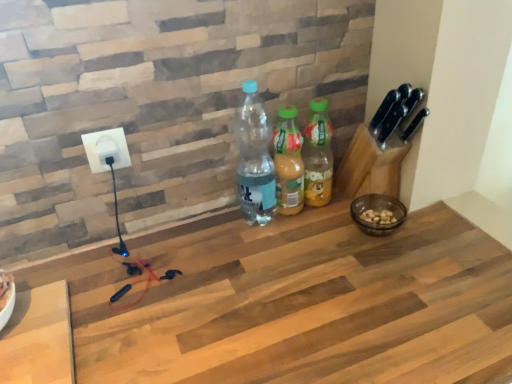
Question: From the image's perspective, does white plastic socket at upper left appear higher than translucent plastic bottle at center, which is counted as the second bottle, starting from the right?

Choices:
 (A) yes
 (B) no

Answer: (A)

Question: From the image's perspective, would you say white plastic socket at upper left is shown under translucent plastic bottle at center, which is counted as the second bottle, starting from the right?

Choices:
 (A) yes
 (B) no

Answer: (B)

Question: Does white plastic socket at upper left touch translucent plastic bottle at center, which is counted as the second bottle, starting from the right?

Choices:
 (A) yes
 (B) no

Answer: (B)

Question: Does white plastic socket at upper left appear on the right side of translucent plastic bottle at center, which is counted as the second bottle, starting from the right?

Choices:
 (A) yes
 (B) no

Answer: (B)

Question: Is white plastic socket at upper left aimed at translucent plastic bottle at center, which is counted as the second bottle, starting from the right?

Choices:
 (A) no
 (B) yes

Answer: (A)

Question: Based on their sizes in the image, would you say translucent plastic bottle at center, the 2th bottle from the left, is bigger or smaller than wooden at center?

Choices:
 (A) small
 (B) big

Answer: (A)

Question: Considering their positions, is translucent plastic bottle at center, the 2th bottle from the left, located in front of or behind wooden at center?

Choices:
 (A) front
 (B) behind

Answer: (B)

Question: Choose the correct answer: Is translucent plastic bottle at center, which is counted as the second bottle, starting from the right, inside wooden at center or outside it?

Choices:
 (A) inside
 (B) outside

Answer: (B)

Question: Is point (281, 127) closer or farther from the camera than point (333, 314)?

Choices:
 (A) farther
 (B) closer

Answer: (A)

Question: Which is correct: wooden at center is inside translucent plastic bottle at center, which is counted as the second bottle, starting from the right, or outside of it?

Choices:
 (A) outside
 (B) inside

Answer: (A)

Question: Is point (91, 269) positioned closer to the camera than point (271, 139)?

Choices:
 (A) closer
 (B) farther

Answer: (A)

Question: Considering the positions of wooden at center and translucent plastic bottle at center, which is counted as the second bottle, starting from the right, in the image, is wooden at center wider or thinner than translucent plastic bottle at center, which is counted as the second bottle, starting from the right,?

Choices:
 (A) thin
 (B) wide

Answer: (B)

Question: In the image, is wooden at center positioned in front of or behind translucent plastic bottle at center, which is counted as the second bottle, starting from the right?

Choices:
 (A) front
 (B) behind

Answer: (A)

Question: Relative to translucent plastic bottle at center, which is counted as the second bottle, starting from the right, is white plastic socket at upper left in front or behind?

Choices:
 (A) behind
 (B) front

Answer: (B)

Question: Is white plastic socket at upper left bigger or smaller than translucent plastic bottle at center, which is counted as the second bottle, starting from the right?

Choices:
 (A) small
 (B) big

Answer: (A)